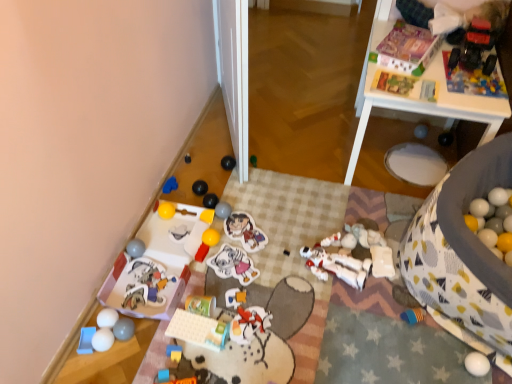
Where is `vacant space in front of white matte sticker at center, the 8th toy from the right`? vacant space in front of white matte sticker at center, the 8th toy from the right is located at coordinates (241, 310).